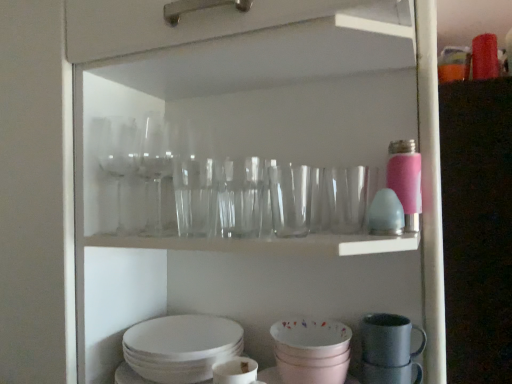
Question: From the image's perspective, is white matte mug at lower center, the first tableware in the left-to-right sequence, located above or below matte pink bowl at lower center, marked as the second tableware in a left-to-right arrangement?

Choices:
 (A) below
 (B) above

Answer: (A)

Question: In terms of size, does white matte mug at lower center, the first tableware in the left-to-right sequence, appear bigger or smaller than matte pink bowl at lower center, which ranks as the third tableware in right-to-left order?

Choices:
 (A) big
 (B) small

Answer: (B)

Question: Which of these objects is positioned farthest from the white matte mug at lower center, the first tableware in the left-to-right sequence?

Choices:
 (A) matte pink bowl at lower center, marked as the second tableware in a left-to-right arrangement
 (B) matte gray mug at lower right, acting as the first tableware starting from the right
 (C) matte gray mug at lower right, marked as the 2th tableware in a right-to-left arrangement

Answer: (C)

Question: Which object is the farthest from the white matte mug at lower center, the 4th tableware from the right?

Choices:
 (A) matte gray mug at lower right, placed as the third tableware when sorted from left to right
 (B) matte pink bowl at lower center, marked as the second tableware in a left-to-right arrangement
 (C) matte gray mug at lower right, which is counted as the fourth tableware, starting from the left

Answer: (A)